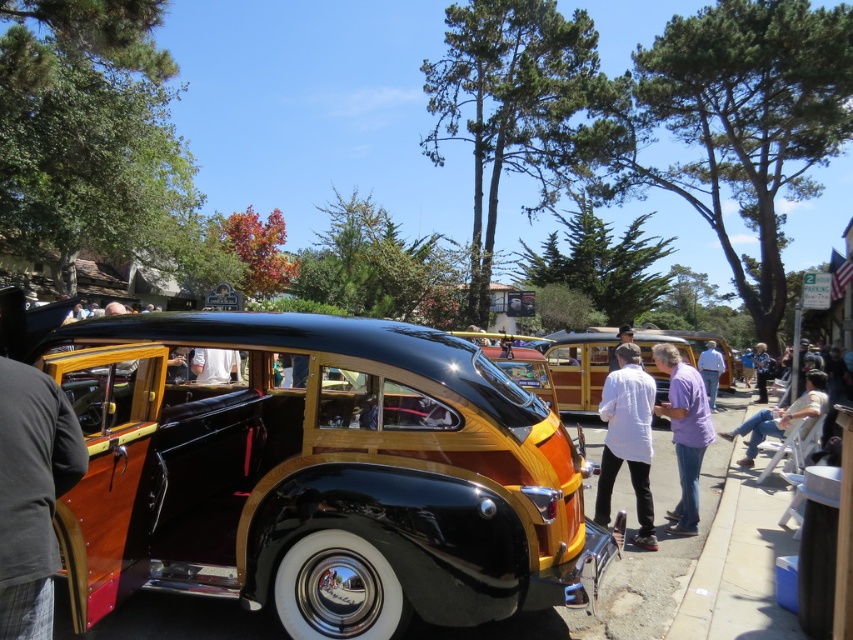
Between point (634, 465) and point (688, 436), which one is positioned in front?

Point (634, 465)

Can you confirm if white cotton shirt at right is positioned above purple cotton shirt at center?

Yes, white cotton shirt at right is above purple cotton shirt at center.

You are a GUI agent. You are given a task and a screenshot of the screen. Output one action in this format:
    pyautogui.click(x=<x>, y=<y>)
    Task: Click on the white cotton shirt at right
    The image size is (853, 640).
    Given the screenshot: What is the action you would take?
    pyautogui.click(x=627, y=440)

Which is above, gray fabric shirt at lower left or light beige fabric chair at right?

gray fabric shirt at lower left

Is point (15, 442) more distant than point (769, 419)?

That is False.

What are the coordinates of `gray fabric shirt at lower left` in the screenshot? It's located at (30, 477).

Is wooden paneling car at center positioned at the back of gray fabric shirt at lower left?

Yes, it is behind gray fabric shirt at lower left.

Is wooden paneling car at center above gray fabric shirt at lower left?

No.

Is point (325, 360) positioned after point (20, 467)?

Yes, it is.

The image size is (853, 640). What are the coordinates of `wooden paneling car at center` in the screenshot? It's located at (317, 474).